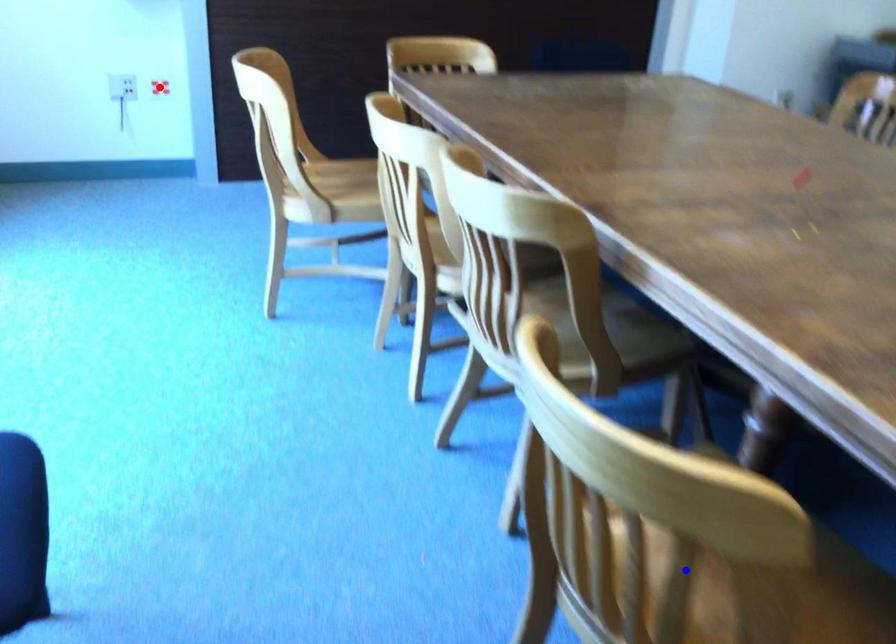
Question: Which of the two points in the image is closer to the camera?

Choices:
 (A) Blue point is closer.
 (B) Red point is closer.

Answer: (A)